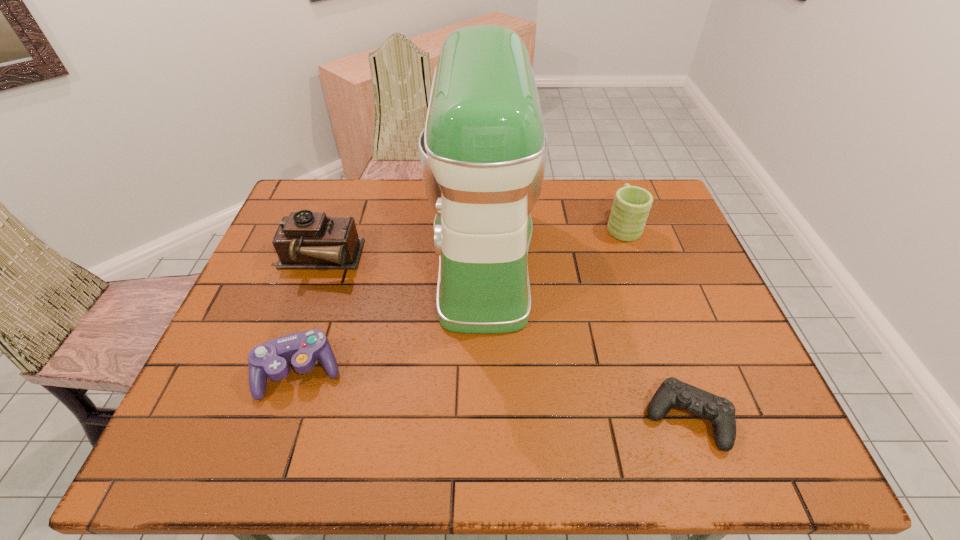
Locate an element on the screen. vacant space located 0.330m on the controls of the third object from right to left is located at coordinates (313, 257).

Find the location of `vacant space located on the horn of the phonograph_record`. vacant space located on the horn of the phonograph_record is located at coordinates (397, 260).

Find the location of a particular element. This screenshot has height=540, width=960. vacant region located on the side of the mug with the handle is located at coordinates (611, 192).

Image resolution: width=960 pixels, height=540 pixels. In order to click on vacant region located on the side of the mug with the handle in this screenshot , I will do `click(613, 199)`.

The image size is (960, 540). In order to click on free region located on the right of the taller control in this screenshot , I will do `click(492, 372)`.

Locate an element on the screen. vacant space situated on the left of the right control is located at coordinates (542, 418).

Locate an element on the screen. Image resolution: width=960 pixels, height=540 pixels. mixer that is positioned at the far edge is located at coordinates (483, 152).

You are a GUI agent. You are given a task and a screenshot of the screen. Output one action in this format:
    pyautogui.click(x=<x>, y=<y>)
    Task: Click on the mug at the far edge
    
    Given the screenshot: What is the action you would take?
    pyautogui.click(x=631, y=206)

Locate an element on the screen. This screenshot has height=540, width=960. object present at the near edge is located at coordinates (672, 392).

I want to click on phonograph_record at the left edge, so click(x=304, y=240).